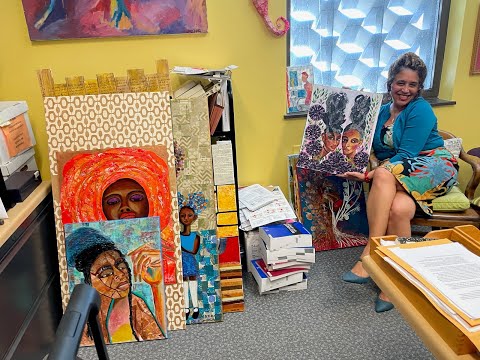
The height and width of the screenshot is (360, 480). I want to click on painting stacked against wall, so click(328, 212).